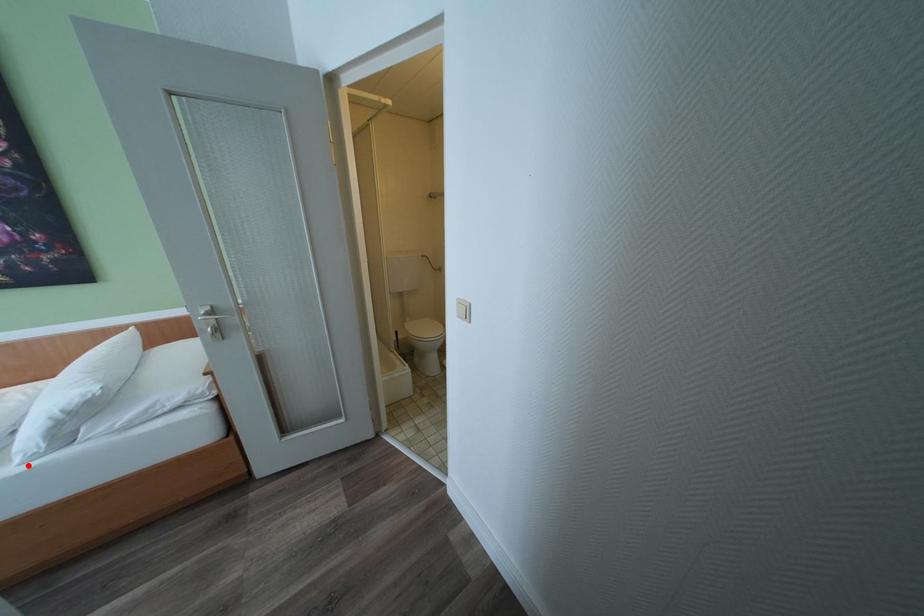
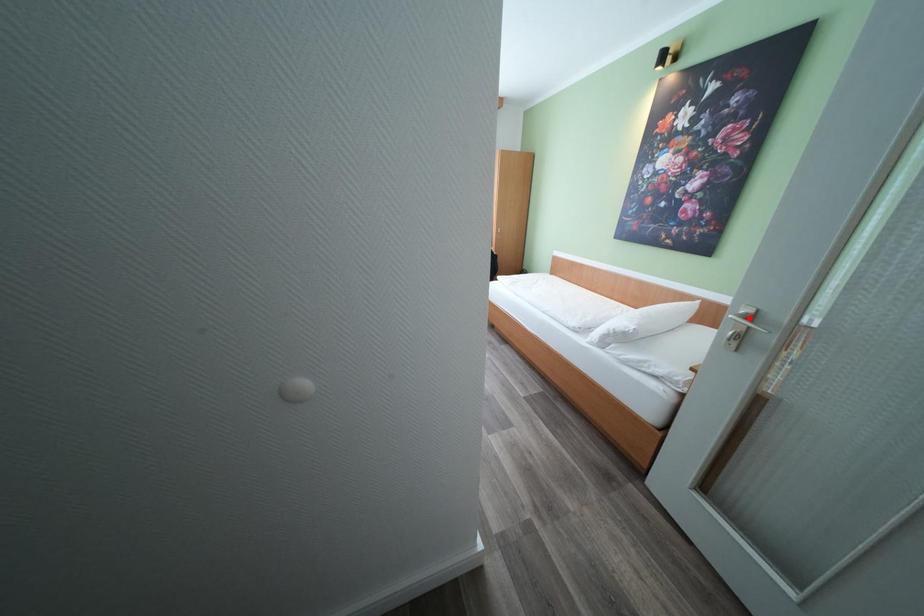
I am providing you with two images of the same scene from different viewpoints. A red point is marked on the first image and another point is marked on the second image. Is the red point in image1 aligned with the point shown in image2?

No